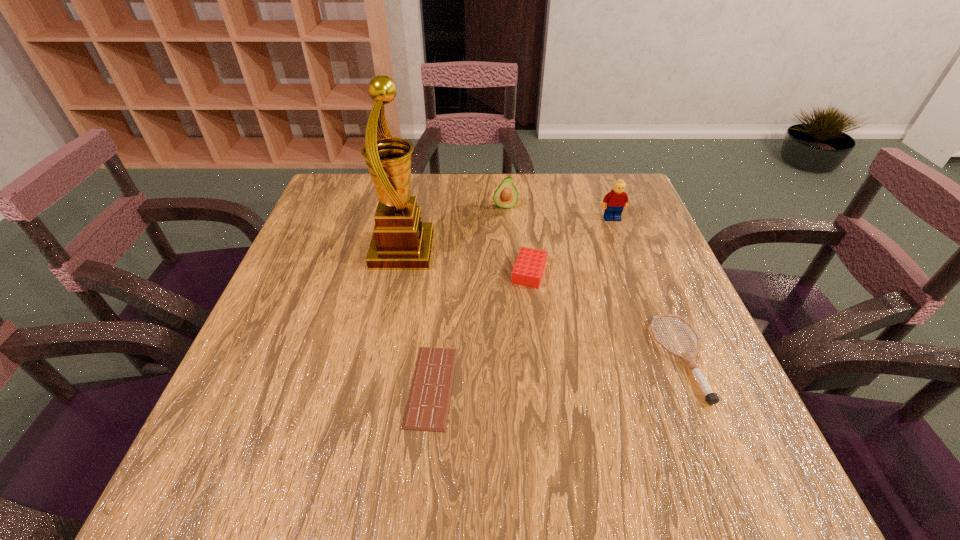
Where is `vacant area that lies between the tallest object and the shortest object`? vacant area that lies between the tallest object and the shortest object is located at coordinates (418, 319).

Locate an element on the screen. The height and width of the screenshot is (540, 960). empty location between the chocolate bar and the farther Lego is located at coordinates (522, 302).

At what (x,y) coordinates should I click in order to perform the action: click on vacant space that is in between the shortest object and the fifth tallest object. Please return your answer as a coordinate pair (x, y). Image resolution: width=960 pixels, height=540 pixels. Looking at the image, I should click on (557, 372).

Find the location of a particular element. This screenshot has height=540, width=960. vacant area that lies between the shortest object and the taller Lego is located at coordinates (522, 302).

The image size is (960, 540). What are the coordinates of `vacant area that lies between the tallest object and the chocolate bar` in the screenshot? It's located at (418, 319).

At what (x,y) coordinates should I click in order to perform the action: click on free space between the nearer Lego and the shortest object. Please return your answer as a coordinate pair (x, y). This screenshot has height=540, width=960. Looking at the image, I should click on (481, 329).

You are a GUI agent. You are given a task and a screenshot of the screen. Output one action in this format:
    pyautogui.click(x=<x>, y=<y>)
    Task: Click on the object that is the closest to the avocado
    
    Given the screenshot: What is the action you would take?
    pyautogui.click(x=401, y=241)

At what (x,y) coordinates should I click in order to perform the action: click on the fourth closest object to the shortest object. Please return your answer as a coordinate pair (x, y). Image resolution: width=960 pixels, height=540 pixels. Looking at the image, I should click on (506, 196).

Identify the location of blank space that satisfies the following two spatial constraints: 1. on the cut side of the fourth shortest object; 2. on the right side of the shorter Lego. The image size is (960, 540). (510, 272).

Image resolution: width=960 pixels, height=540 pixels. Find the location of `free space that satisfies the following two spatial constraints: 1. on the cut side of the tennis racket; 2. on the right side of the fourth shortest object`. free space that satisfies the following two spatial constraints: 1. on the cut side of the tennis racket; 2. on the right side of the fourth shortest object is located at coordinates (516, 358).